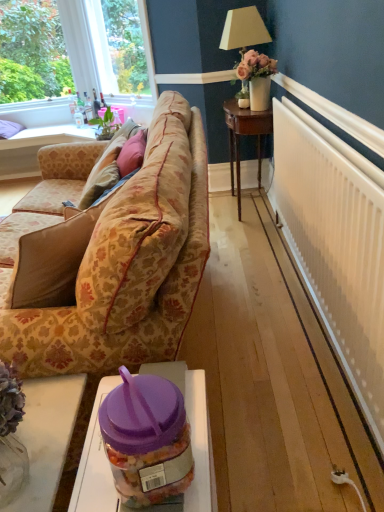
Question: From a real-world perspective, is purple plastic jar at lower center, arranged as the 2th table when viewed from the top, physically located above or below green leafy plant at upper left?

Choices:
 (A) below
 (B) above

Answer: (A)

Question: Visually, is purple plastic jar at lower center, the second table in the bottom-to-top sequence, positioned to the left or to the right of green leafy plant at upper left?

Choices:
 (A) left
 (B) right

Answer: (B)

Question: Estimate the real-world distances between objects in this image. Which object is closer to the green leafy plant at upper left?

Choices:
 (A) purple plastic jar at lower center, which is counted as the 3th table, starting from the back
 (B) clear glass vase at lower left, the 3th table viewed from the top
 (C) clear glass window at upper left
 (D) wooden coffee table at lower left, the 1th table viewed from the back
 (E) floral-patterned fabric couch at center-left

Answer: (C)

Question: Based on their relative distances, which object is farther from the wooden coffee table at lower left, the third table positioned from the right?

Choices:
 (A) clear glass window at upper left
 (B) purple plastic jar at lower center, marked as the first table in a front-to-back arrangement
 (C) velvet pink pillow at center
 (D) floral-patterned fabric couch at center-left
 (E) clear glass vase at lower left, which is counted as the second table, starting from the front

Answer: (B)